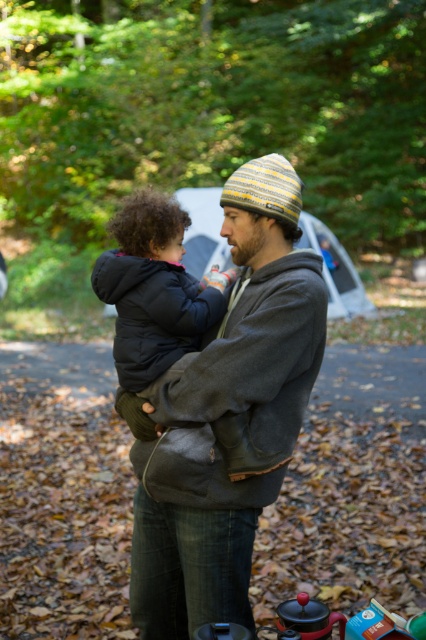
Question: Can you confirm if gray fleece hoodie at center is smaller than dark gray puffy coat at center?

Choices:
 (A) no
 (B) yes

Answer: (A)

Question: Is gray fleece hoodie at center bigger than dark gray puffy coat at center?

Choices:
 (A) yes
 (B) no

Answer: (A)

Question: Which point is farther from the camera taking this photo?

Choices:
 (A) (161, 378)
 (B) (132, 589)

Answer: (B)

Question: Which of the following is the farthest from the observer?

Choices:
 (A) (138, 516)
 (B) (144, 355)

Answer: (A)

Question: Which point appears closest to the camera in this image?

Choices:
 (A) (127, 241)
 (B) (221, 369)

Answer: (B)

Question: Can you confirm if gray fleece hoodie at center is bigger than dark gray puffy coat at center?

Choices:
 (A) yes
 (B) no

Answer: (A)